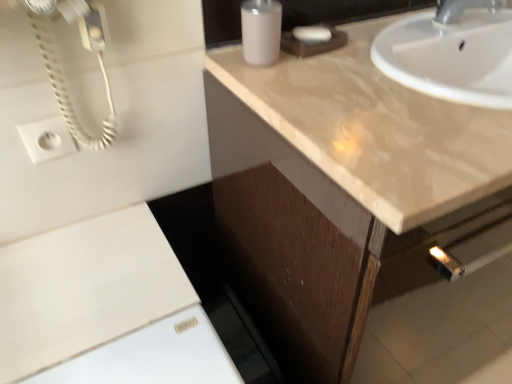
Question: Is white matte soap at upper center placed right next to white plastic outlet at upper left?

Choices:
 (A) no
 (B) yes

Answer: (A)

Question: Considering the relative sizes of white matte soap at upper center and white plastic outlet at upper left in the image provided, is white matte soap at upper center wider than white plastic outlet at upper left?

Choices:
 (A) yes
 (B) no

Answer: (A)

Question: Does white matte soap at upper center have a larger size compared to white plastic outlet at upper left?

Choices:
 (A) no
 (B) yes

Answer: (B)

Question: From a real-world perspective, is white matte soap at upper center located beneath white plastic outlet at upper left?

Choices:
 (A) no
 (B) yes

Answer: (A)

Question: Is white matte soap at upper center smaller than white plastic outlet at upper left?

Choices:
 (A) yes
 (B) no

Answer: (B)

Question: Is white matte soap at upper center oriented away from white plastic outlet at upper left?

Choices:
 (A) yes
 (B) no

Answer: (B)

Question: Is glossy beige countertop at upper right positioned beyond the bounds of matte plastic soap dispenser at upper center?

Choices:
 (A) no
 (B) yes

Answer: (B)

Question: From a real-world perspective, does glossy beige countertop at upper right sit lower than matte plastic soap dispenser at upper center?

Choices:
 (A) yes
 (B) no

Answer: (A)

Question: Is glossy beige countertop at upper right facing away from matte plastic soap dispenser at upper center?

Choices:
 (A) yes
 (B) no

Answer: (B)

Question: Is glossy beige countertop at upper right bigger than matte plastic soap dispenser at upper center?

Choices:
 (A) no
 (B) yes

Answer: (B)

Question: Considering the relative sizes of glossy beige countertop at upper right and matte plastic soap dispenser at upper center in the image provided, is glossy beige countertop at upper right taller than matte plastic soap dispenser at upper center?

Choices:
 (A) no
 (B) yes

Answer: (A)

Question: Is glossy beige countertop at upper right at the left side of matte plastic soap dispenser at upper center?

Choices:
 (A) no
 (B) yes

Answer: (A)

Question: From the image's perspective, does white matte cabinet at lower left appear lower than matte brown cabinet at upper right?

Choices:
 (A) no
 (B) yes

Answer: (B)